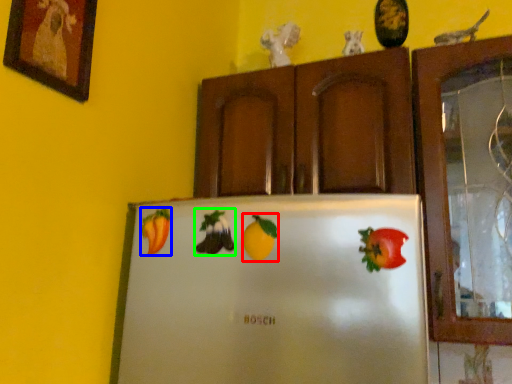
Question: Based on their relative distances, which object is nearer to fruit (highlighted by a red box)? Choose from fruit (highlighted by a blue box) and fruit (highlighted by a green box).

Choices:
 (A) fruit
 (B) fruit

Answer: (B)